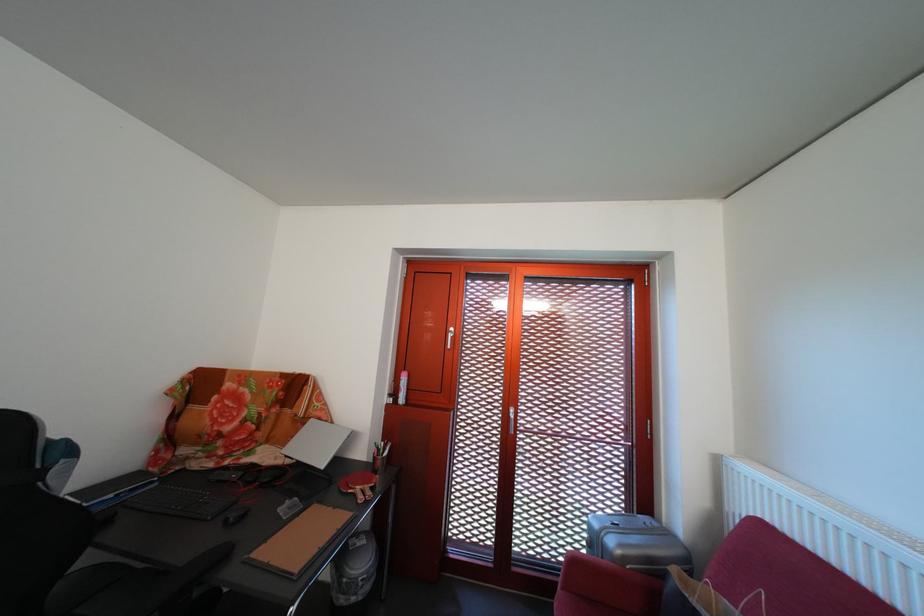
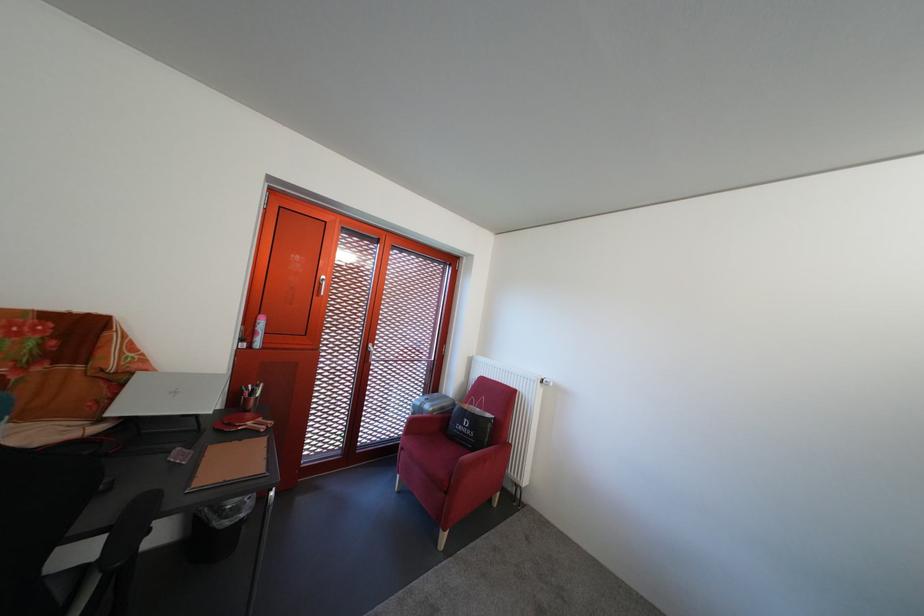
Where in the second image is the point corresponding to [400,402] from the first image?

(252, 346)